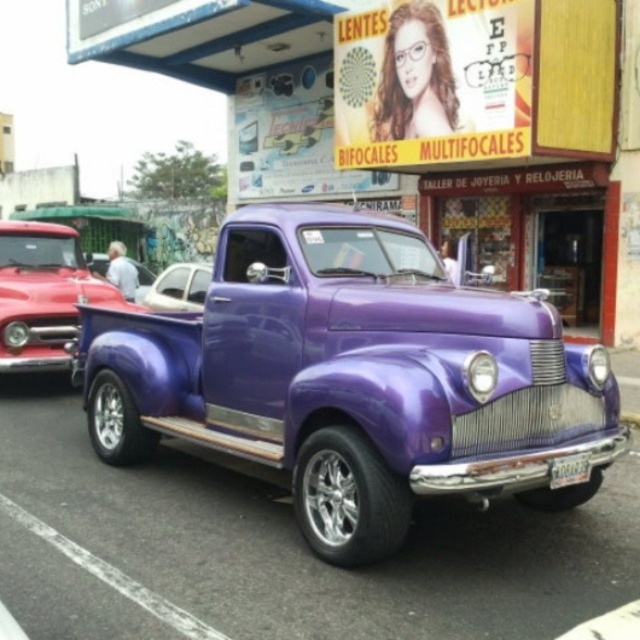
You are a photographer planning to take a photo of the shiny purple truck at center and the shiny red truck at left. Since you want to capture their full height in the frame, which truck will require you to stand closer to it to ensure it fits vertically in your camera viewfinder?

The shiny purple truck at center has a greater height compared to the shiny red truck at left, so you need to stand closer to the shiny purple truck at center to capture its full height in the frame.

You are a delivery driver who needs to park your truck in a space that can only accommodate trucks up to the width of the shiny purple truck at center. You have a truck similar in size to the purple metallic truck at center. Will your truck fit in the parking space?

The shiny purple truck at center is narrower than the purple metallic truck at center. Since the parking space can only accommodate trucks up to the width of the shiny purple truck at center, your truck, which is wider, will not fit in the parking space.

Consider the image. You are a pedestrian standing on the sidewalk and see the shiny purple truck at center and the shiny red truck at left. Which truck is closer to you?

The shiny purple truck at center is closer to you because it is in front of the shiny red truck at left.